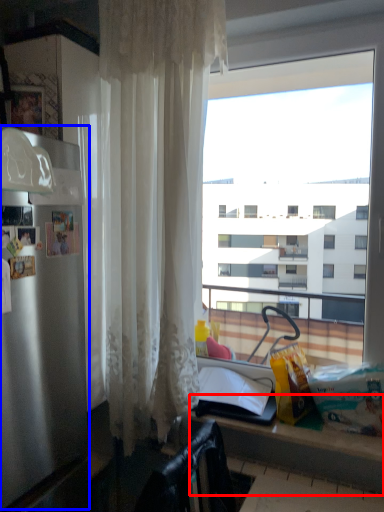
Question: Which point is further to the camera, counter (highlighted by a red box) or appliance (highlighted by a blue box)?

Choices:
 (A) counter
 (B) appliance

Answer: (B)